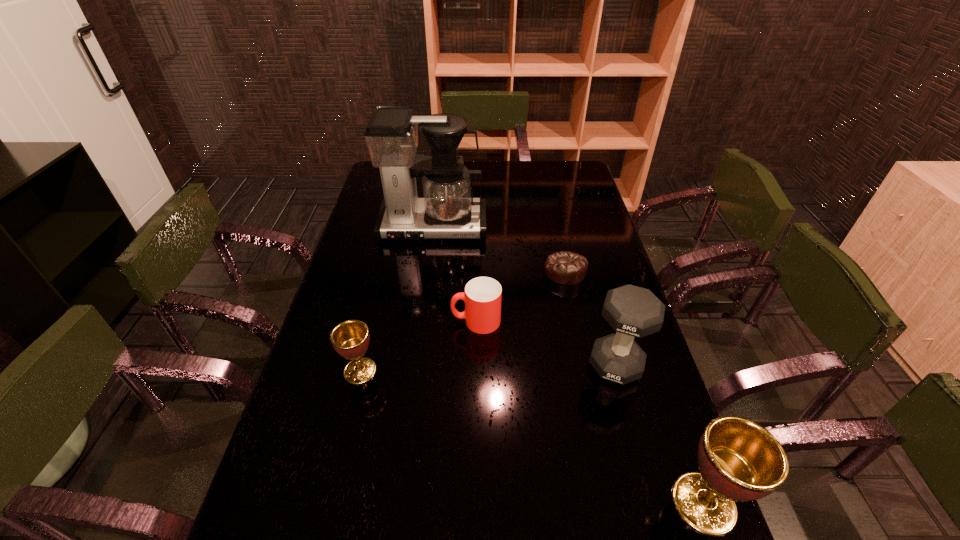
Please point a space for a new chalice to maintain equal intervals. Please provide its 2D coordinates. Your answer should be formatted as a tuple, i.e. [(x, y)], where the tuple contains the x and y coordinates of a point satisfying the conditions above.

[(512, 429)]